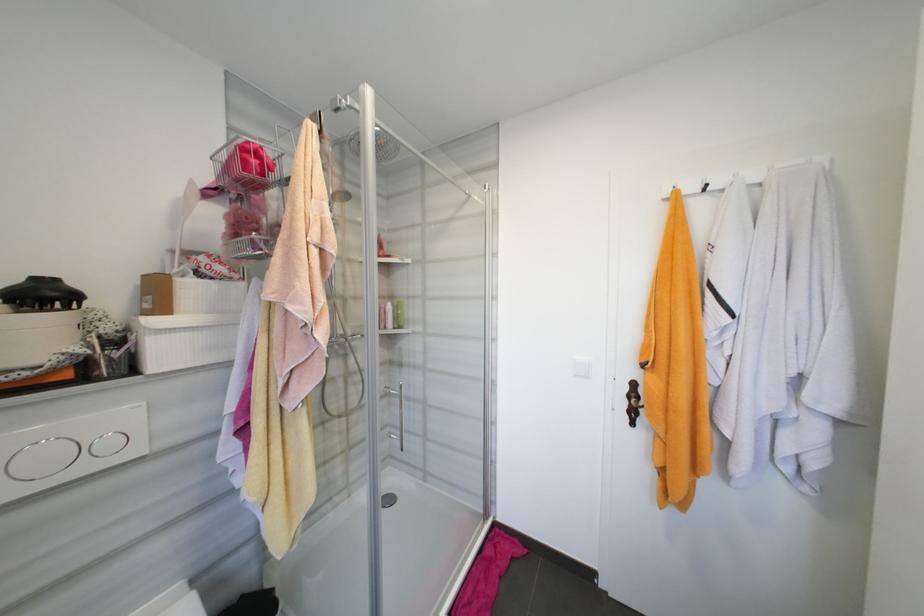
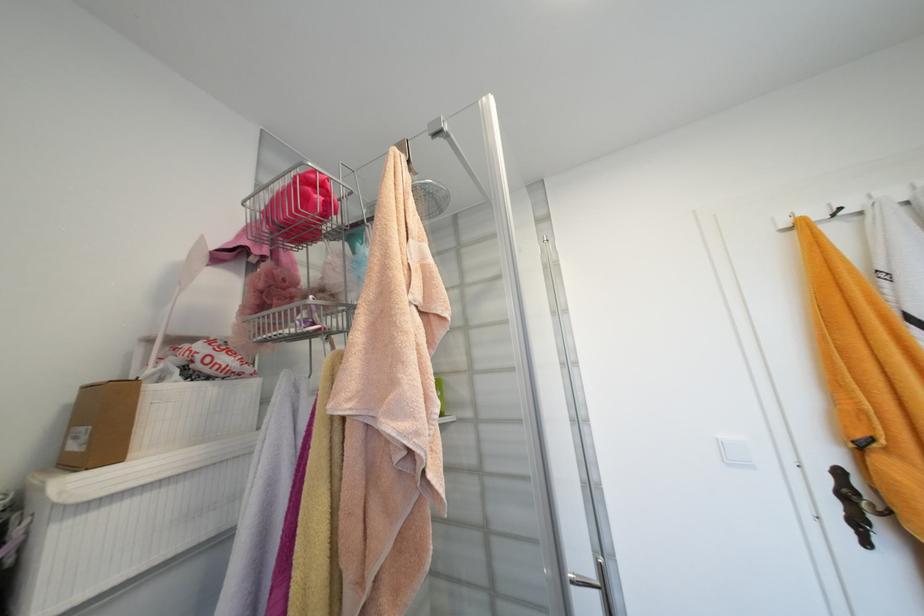
Question: The first image is from the beginning of the video and the second image is from the end. How did the camera likely rotate when shooting the video?

Choices:
 (A) Left
 (B) Right
 (C) Up
 (D) Down

Answer: (C)